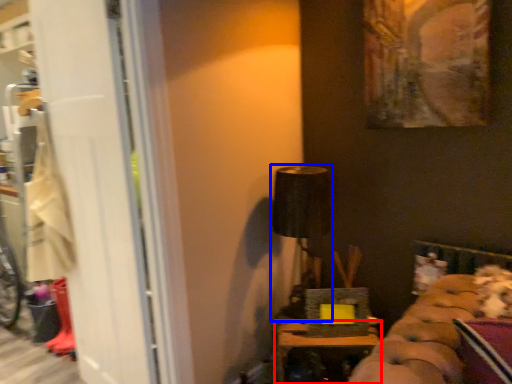
Question: Which object is further to the camera taking this photo, furniture (highlighted by a red box) or lamp (highlighted by a blue box)?

Choices:
 (A) furniture
 (B) lamp

Answer: (B)